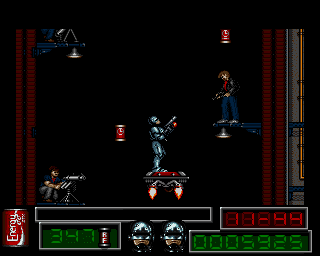
Identify the location of red siren lamp (2). Image resolution: width=320 pixels, height=256 pixels. (122, 130), (226, 35).